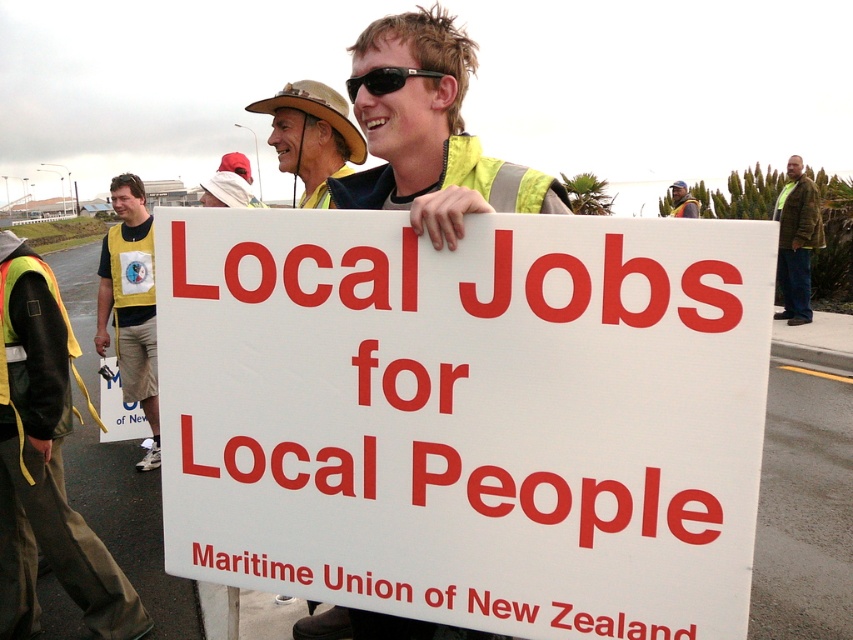
Between point (4, 260) and point (671, 186), which one is positioned in front?

Positioned in front is point (4, 260).

Does reflective yellow vest at left appear on the left side of matte yellow safety vest at center?

Correct, you'll find reflective yellow vest at left to the left of matte yellow safety vest at center.

Does point (86, 592) come closer to viewer compared to point (682, 205)?

Yes.

Identify the location of reflective yellow vest at left. (48, 483).

Can you confirm if black plastic sunglasses at center is shorter than matte yellow safety vest at center?

Yes.

Can you confirm if black plastic sunglasses at center is thinner than matte yellow safety vest at center?

Correct, black plastic sunglasses at center's width is less than matte yellow safety vest at center's.

Image resolution: width=853 pixels, height=640 pixels. What do you see at coordinates (384, 80) in the screenshot? I see `black plastic sunglasses at center` at bounding box center [384, 80].

I want to click on black plastic sunglasses at center, so click(x=384, y=80).

Is white paper sign at center thinner than yellow reflective vest at left?

No, white paper sign at center is not thinner than yellow reflective vest at left.

Looking at this image, between white paper sign at center and yellow reflective vest at left, which one has less height?

With less height is white paper sign at center.

The width and height of the screenshot is (853, 640). I want to click on white paper sign at center, so click(469, 416).

The height and width of the screenshot is (640, 853). Identify the location of white paper sign at center. (469, 416).